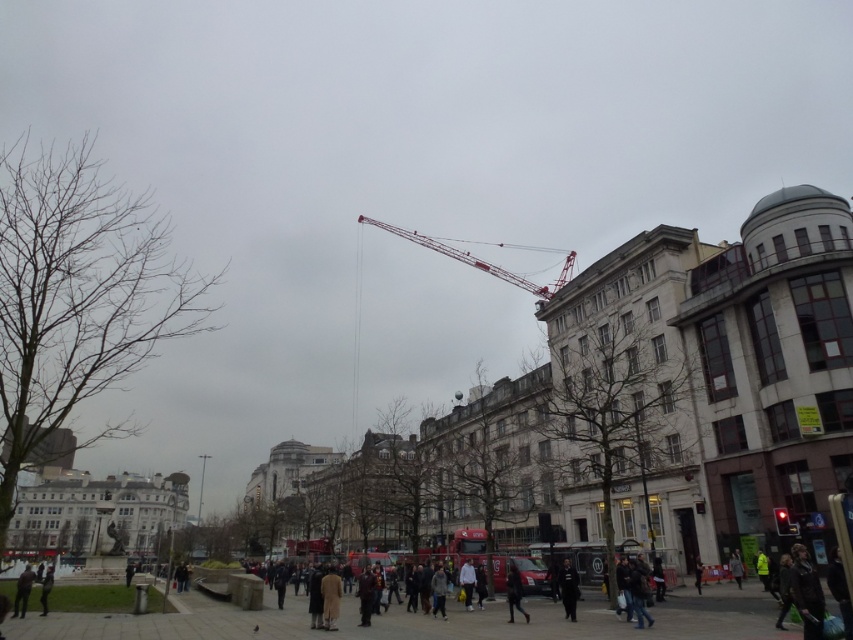
Can you confirm if metallic red crane at upper center is positioned to the left of dark gray jacket at lower left?

No, metallic red crane at upper center is not to the left of dark gray jacket at lower left.

Which is below, metallic red crane at upper center or dark gray jacket at lower left?

Positioned lower is dark gray jacket at lower left.

Between point (436, 246) and point (19, 614), which one is positioned behind?

The point (436, 246) is behind.

The height and width of the screenshot is (640, 853). Identify the location of metallic red crane at upper center. (480, 259).